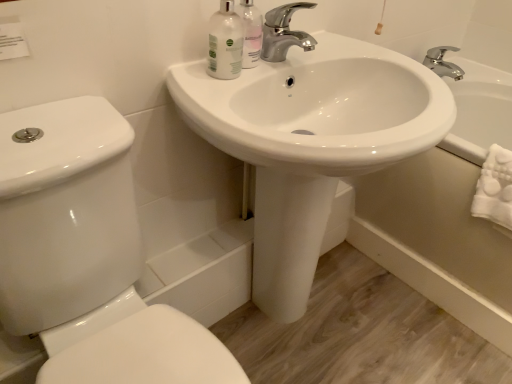
Identify the location of free space in front of chrome metallic faucet at upper center. (242, 76).